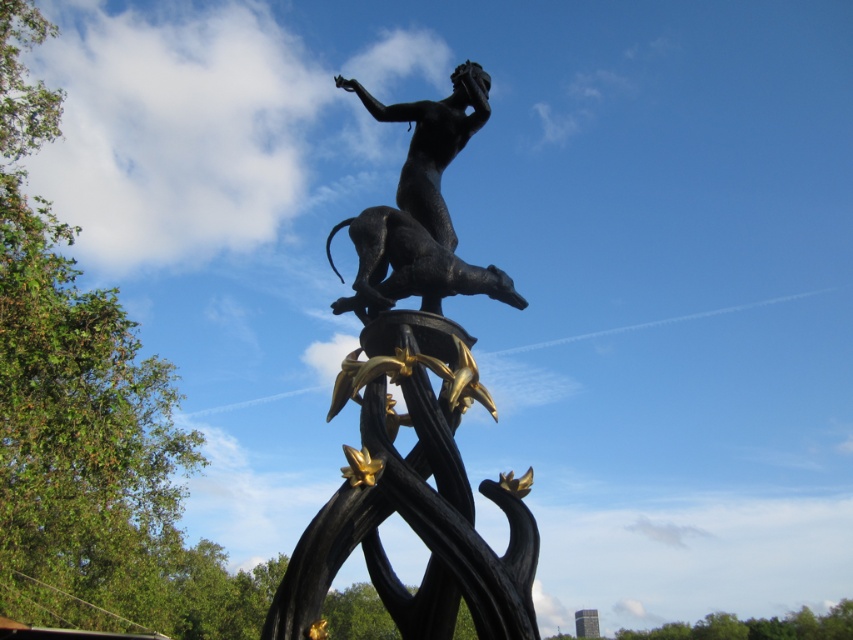
You are an art critic standing in front of the sculpture. You notice two parts of the sculpture labeled as the black polished statue at center and the black polished statue at upper center. Which one is positioned to the right of the other?

The black polished statue at center is positioned to the right of the black polished statue at upper center.